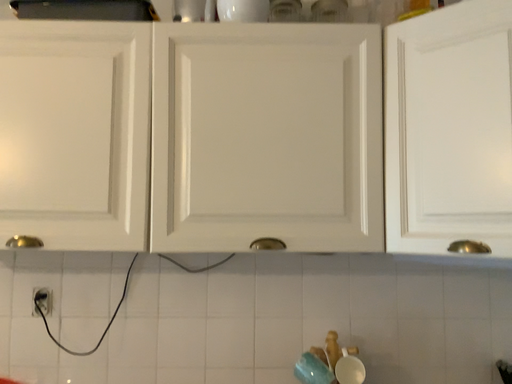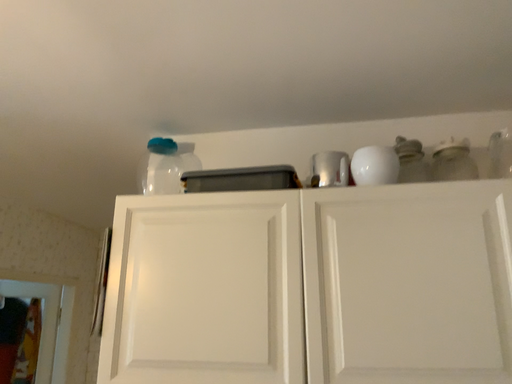
Question: How did the camera likely rotate when shooting the video?

Choices:
 (A) rotated left
 (B) rotated right

Answer: (A)